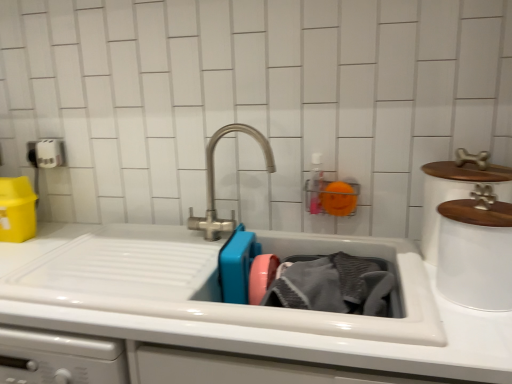
Identify the location of unoccupied area in front of white matte pet food container at upper right, which ranks as the second appliance in back-to-front order. The width and height of the screenshot is (512, 384). (477, 334).